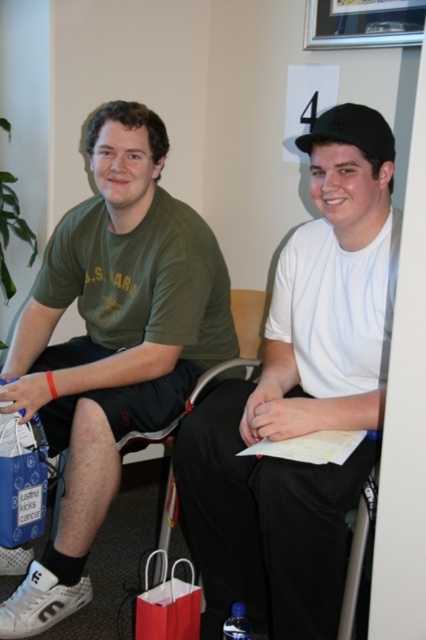
Question: Estimate the real-world distances between objects in this image. Which object is farther from the blue fabric shopping bag at lower left?

Choices:
 (A) green matte t-shirt at left
 (B) red paper shopping bag at lower center
 (C) white matte shirt at center

Answer: (C)

Question: Among these points, which one is farthest from the camera?

Choices:
 (A) (393, 161)
 (B) (296, 424)

Answer: (B)

Question: Does white matte shirt at center appear over black matte baseball cap at upper right?

Choices:
 (A) yes
 (B) no

Answer: (B)

Question: Which point is closer to the camera?

Choices:
 (A) black matte baseball cap at upper right
 (B) green matte t-shirt at left

Answer: (A)

Question: Does green matte t-shirt at left have a lesser width compared to black matte baseball cap at upper right?

Choices:
 (A) no
 (B) yes

Answer: (A)

Question: Does white matte shirt at center have a larger size compared to blue fabric shopping bag at lower left?

Choices:
 (A) no
 (B) yes

Answer: (B)